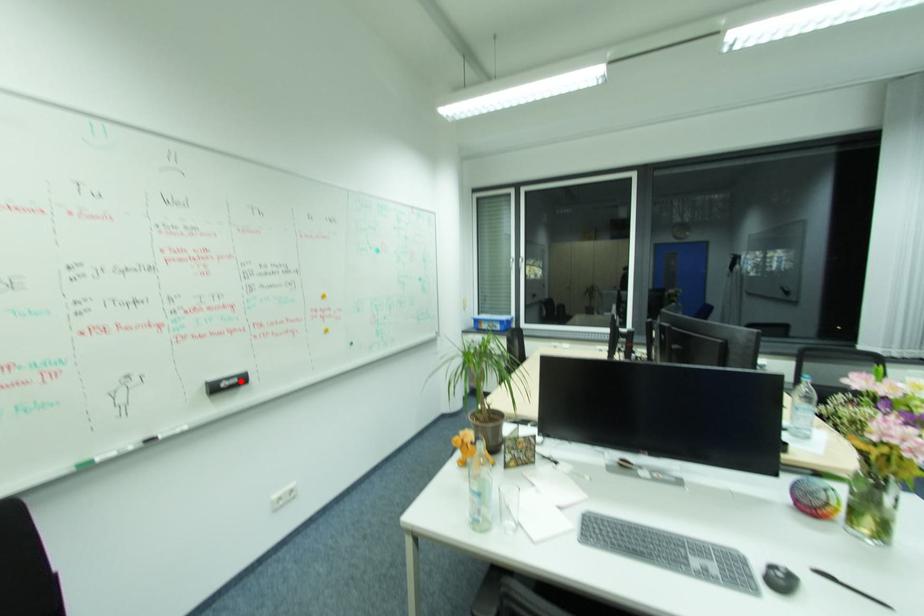
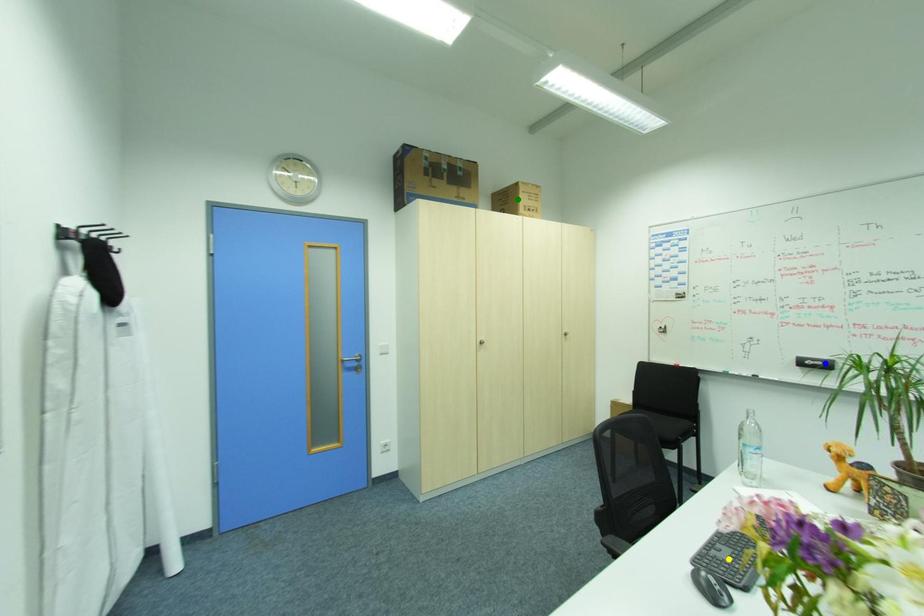
Question: I am providing you with two images of the same scene from different viewpoints. A red point is marked on the first image. You are given multiple points on the second image. Which point in image 2 represents the same 3d spot as the red point in image 1?

Choices:
 (A) green point
 (B) blue point
 (C) yellow point

Answer: (B)